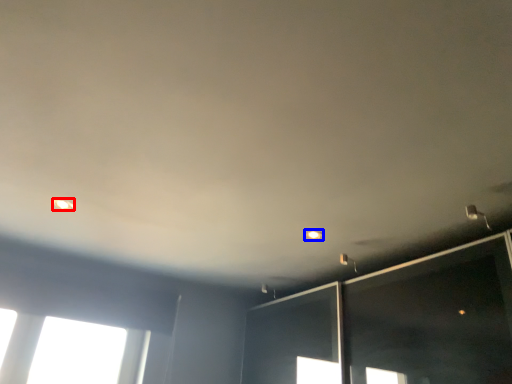
Question: Which object appears closest to the camera in this image, dot (highlighted by a red box) or dot (highlighted by a blue box)?

Choices:
 (A) dot
 (B) dot

Answer: (A)